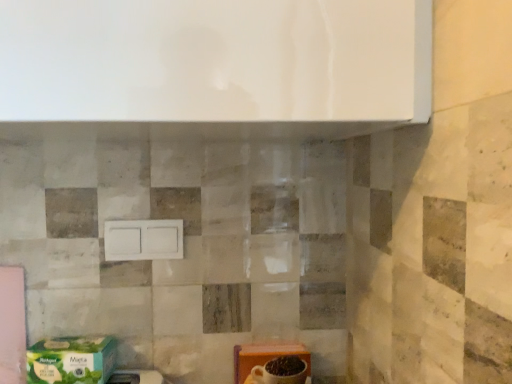
You are a GUI agent. You are given a task and a screenshot of the screen. Output one action in this format:
    pyautogui.click(x=<x>, y=<y>)
    Task: Click on the green matte cardboard box at lower left, which appears as the first cardboard box when viewed from the left
    
    Given the screenshot: What is the action you would take?
    pyautogui.click(x=71, y=360)

Find the location of a particular element. Image resolution: width=512 pixels, height=384 pixels. white matte switch at center is located at coordinates pos(143,240).

The height and width of the screenshot is (384, 512). What are the coordinates of `green matte cardboard box at lower left, placed as the 2th cardboard box when sorted from right to left` in the screenshot? It's located at (71, 360).

Is orange cardboard box at lower right, which is the 2th cardboard box in left-to-right order, taller or shorter than white matte switch at center?

orange cardboard box at lower right, which is the 2th cardboard box in left-to-right order, is taller than white matte switch at center.

Between point (309, 353) and point (130, 244), which one is positioned in front?

The point (130, 244) is more forward.

How far apart are orange cardboard box at lower right, which appears as the first cardboard box when viewed from the right, and white matte switch at center?

orange cardboard box at lower right, which appears as the first cardboard box when viewed from the right, is 11.12 inches from white matte switch at center.

From the image's perspective, is orange cardboard box at lower right, which appears as the first cardboard box when viewed from the right, over green matte cardboard box at lower left, placed as the 2th cardboard box when sorted from right to left?

Incorrect, from the image's perspective, orange cardboard box at lower right, which appears as the first cardboard box when viewed from the right, is lower than green matte cardboard box at lower left, placed as the 2th cardboard box when sorted from right to left.

Locate an element on the screen. The height and width of the screenshot is (384, 512). cardboard box on the right of green matte cardboard box at lower left, which appears as the first cardboard box when viewed from the left is located at coordinates (265, 356).

Based on the photo, considering the relative sizes of orange cardboard box at lower right, which is the 2th cardboard box in left-to-right order, and green matte cardboard box at lower left, placed as the 2th cardboard box when sorted from right to left, in the image provided, is orange cardboard box at lower right, which is the 2th cardboard box in left-to-right order, wider than green matte cardboard box at lower left, placed as the 2th cardboard box when sorted from right to left,?

In fact, orange cardboard box at lower right, which is the 2th cardboard box in left-to-right order, might be narrower than green matte cardboard box at lower left, placed as the 2th cardboard box when sorted from right to left.

How many degrees apart are the facing directions of green matte cardboard box at lower left, placed as the 2th cardboard box when sorted from right to left, and orange cardboard box at lower right, which is the 2th cardboard box in left-to-right order?

The facing directions of green matte cardboard box at lower left, placed as the 2th cardboard box when sorted from right to left, and orange cardboard box at lower right, which is the 2th cardboard box in left-to-right order, are 0.00309 degrees apart.

Is green matte cardboard box at lower left, which appears as the first cardboard box when viewed from the left, far from orange cardboard box at lower right, which is the 2th cardboard box in left-to-right order?

No, green matte cardboard box at lower left, which appears as the first cardboard box when viewed from the left, is not far from orange cardboard box at lower right, which is the 2th cardboard box in left-to-right order.

Which of these two, green matte cardboard box at lower left, placed as the 2th cardboard box when sorted from right to left, or orange cardboard box at lower right, which is the 2th cardboard box in left-to-right order, is smaller?

green matte cardboard box at lower left, placed as the 2th cardboard box when sorted from right to left, is smaller.

Between point (89, 340) and point (241, 383), which one is positioned in front?

Positioned in front is point (89, 340).

You are a GUI agent. You are given a task and a screenshot of the screen. Output one action in this format:
    pyautogui.click(x=<x>, y=<y>)
    Task: Click on the cardboard box that is the 1st object directly below the white matte switch at center (from a real-world perspective)
    
    Given the screenshot: What is the action you would take?
    pyautogui.click(x=71, y=360)

Which is more to the left, green matte cardboard box at lower left, placed as the 2th cardboard box when sorted from right to left, or white matte switch at center?

Positioned to the left is green matte cardboard box at lower left, placed as the 2th cardboard box when sorted from right to left.

From a real-world perspective, is green matte cardboard box at lower left, which appears as the first cardboard box when viewed from the left, located beneath white matte switch at center?

Yes, from a real-world perspective, green matte cardboard box at lower left, which appears as the first cardboard box when viewed from the left, is below white matte switch at center.

Between green matte cardboard box at lower left, placed as the 2th cardboard box when sorted from right to left, and white matte switch at center, which one has smaller size?

Smaller between the two is white matte switch at center.

Which is correct: white matte switch at center is inside green matte cardboard box at lower left, placed as the 2th cardboard box when sorted from right to left, or outside of it?

white matte switch at center is not inside green matte cardboard box at lower left, placed as the 2th cardboard box when sorted from right to left, it's outside.

The image size is (512, 384). Find the location of `drawer above the green matte cardboard box at lower left, which appears as the first cardboard box when viewed from the left (from a real-world perspective)`. drawer above the green matte cardboard box at lower left, which appears as the first cardboard box when viewed from the left (from a real-world perspective) is located at coordinates (143, 240).

Which of these two, white matte switch at center or green matte cardboard box at lower left, which appears as the first cardboard box when viewed from the left, is thinner?

white matte switch at center.

Considering the points (169, 237) and (248, 347), which point is in front, point (169, 237) or point (248, 347)?

The point (169, 237) is closer to the camera.

Consider the image. Is white matte switch at center looking in the opposite direction of orange cardboard box at lower right, which appears as the first cardboard box when viewed from the right?

That's not correct — white matte switch at center is not looking away from orange cardboard box at lower right, which appears as the first cardboard box when viewed from the right.

Is white matte switch at center placed right next to orange cardboard box at lower right, which is the 2th cardboard box in left-to-right order?

They are not placed beside each other.

Can you tell me how much white matte switch at center and orange cardboard box at lower right, which is the 2th cardboard box in left-to-right order, differ in facing direction?

1.64 degrees separate the facing orientations of white matte switch at center and orange cardboard box at lower right, which is the 2th cardboard box in left-to-right order.

Where is `cardboard box lying on the right of white matte switch at center`? The width and height of the screenshot is (512, 384). cardboard box lying on the right of white matte switch at center is located at coordinates (265, 356).

Identify the location of cardboard box located below the green matte cardboard box at lower left, which appears as the first cardboard box when viewed from the left (from the image's perspective). (265, 356).

Considering their positions, is white matte switch at center positioned further to orange cardboard box at lower right, which is the 2th cardboard box in left-to-right order, than green matte cardboard box at lower left, which appears as the first cardboard box when viewed from the left?

Based on the image, green matte cardboard box at lower left, which appears as the first cardboard box when viewed from the left, appears to be further to orange cardboard box at lower right, which is the 2th cardboard box in left-to-right order.

When comparing their distances from white matte switch at center, does orange cardboard box at lower right, which is the 2th cardboard box in left-to-right order, or green matte cardboard box at lower left, placed as the 2th cardboard box when sorted from right to left, seem further?

The object further to white matte switch at center is orange cardboard box at lower right, which is the 2th cardboard box in left-to-right order.

When comparing their distances from white matte switch at center, does green matte cardboard box at lower left, which appears as the first cardboard box when viewed from the left, or orange cardboard box at lower right, which appears as the first cardboard box when viewed from the right, seem closer?

The object closer to white matte switch at center is green matte cardboard box at lower left, which appears as the first cardboard box when viewed from the left.

Looking at the image, which one is located further to green matte cardboard box at lower left, placed as the 2th cardboard box when sorted from right to left, orange cardboard box at lower right, which appears as the first cardboard box when viewed from the right, or white matte switch at center?

Based on the image, orange cardboard box at lower right, which appears as the first cardboard box when viewed from the right, appears to be further to green matte cardboard box at lower left, placed as the 2th cardboard box when sorted from right to left.

From the image, which object appears to be nearer to green matte cardboard box at lower left, placed as the 2th cardboard box when sorted from right to left, white matte switch at center or orange cardboard box at lower right, which appears as the first cardboard box when viewed from the right?

white matte switch at center lies closer to green matte cardboard box at lower left, placed as the 2th cardboard box when sorted from right to left, than the other object.

Looking at the image, which one is located closer to orange cardboard box at lower right, which is the 2th cardboard box in left-to-right order, green matte cardboard box at lower left, which appears as the first cardboard box when viewed from the left, or white matte switch at center?

Among the two, white matte switch at center is located nearer to orange cardboard box at lower right, which is the 2th cardboard box in left-to-right order.

Locate an element on the screen. drawer between green matte cardboard box at lower left, placed as the 2th cardboard box when sorted from right to left, and orange cardboard box at lower right, which is the 2th cardboard box in left-to-right order is located at coordinates (143, 240).